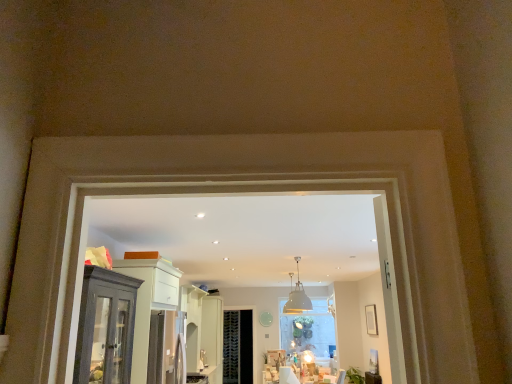
Question: Would you say white glossy door at center is inside or outside satin silver fridge at center?

Choices:
 (A) outside
 (B) inside

Answer: (A)

Question: From their relative heights in the image, would you say white glossy door at center is taller or shorter than satin silver fridge at center?

Choices:
 (A) tall
 (B) short

Answer: (A)

Question: Estimate the real-world distances between objects in this image. Which object is closer to the white glossy door at center?

Choices:
 (A) white matte light fixture at upper center
 (B) matte dark wood cabinet at left
 (C) satin silver fridge at center
 (D) matte white picture frame at right
 (E) black mesh screen door at center

Answer: (E)

Question: Which is nearer to the matte dark wood cabinet at left?

Choices:
 (A) satin silver fridge at center
 (B) white matte light fixture at upper center
 (C) matte white picture frame at right
 (D) white glossy door at center
 (E) black mesh screen door at center

Answer: (A)